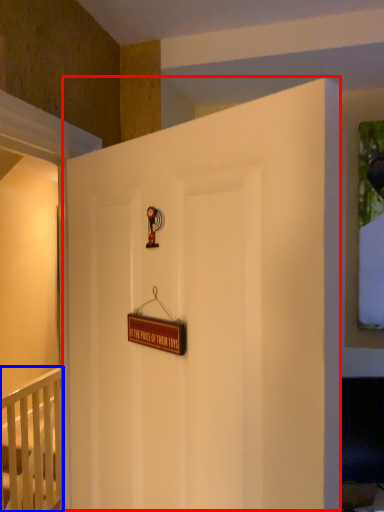
Question: Which point is closer to the camera, door (highlighted by a red box) or infant bed (highlighted by a blue box)?

Choices:
 (A) door
 (B) infant bed

Answer: (A)